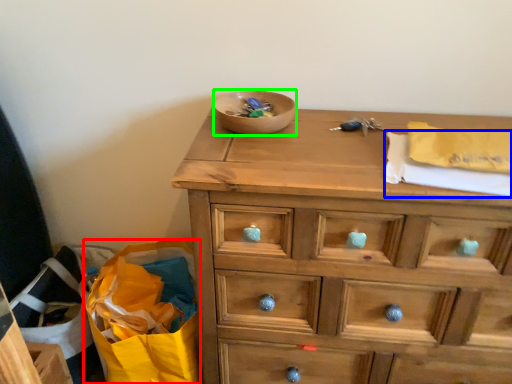
Question: Which object is the closest to the shopping bag (highlighted by a red box)? Choose among these: clothe (highlighted by a blue box) or bowl (highlighted by a green box).

Choices:
 (A) clothe
 (B) bowl

Answer: (B)